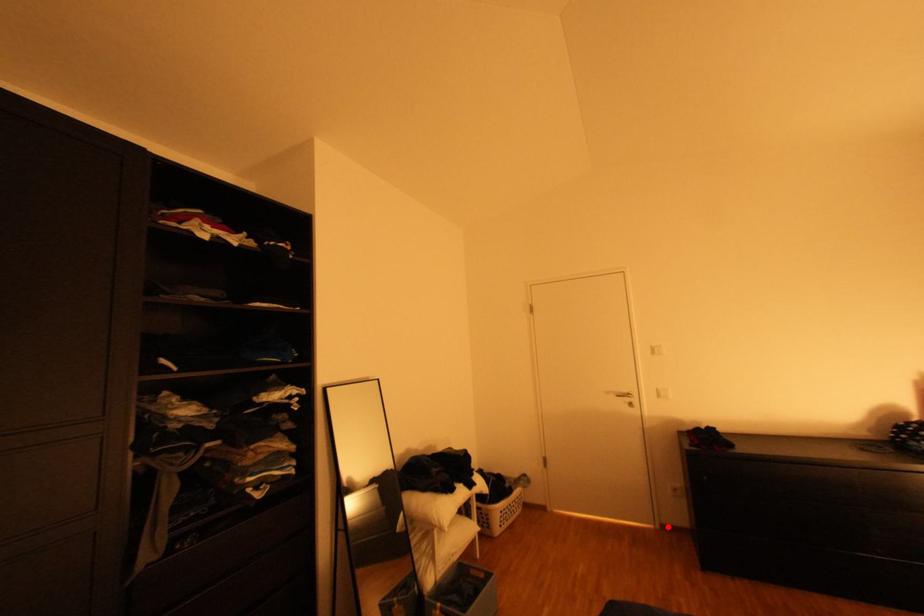
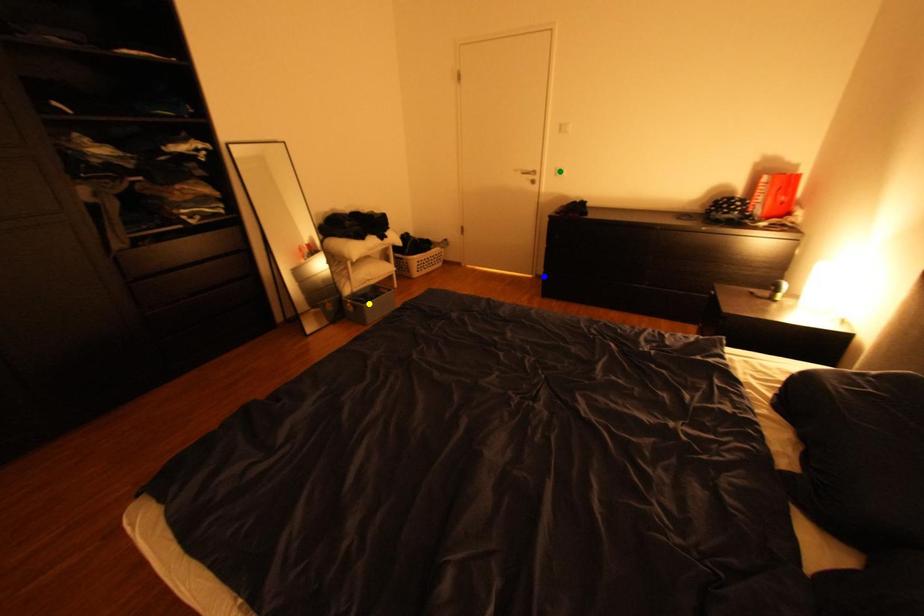
Question: I am providing you with two images of the same scene from different viewpoints. A red point is marked on the first image. You are given multiple points on the second image. Which mark in image 2 goes with the point in image 1?

Choices:
 (A) green point
 (B) blue point
 (C) yellow point

Answer: (B)